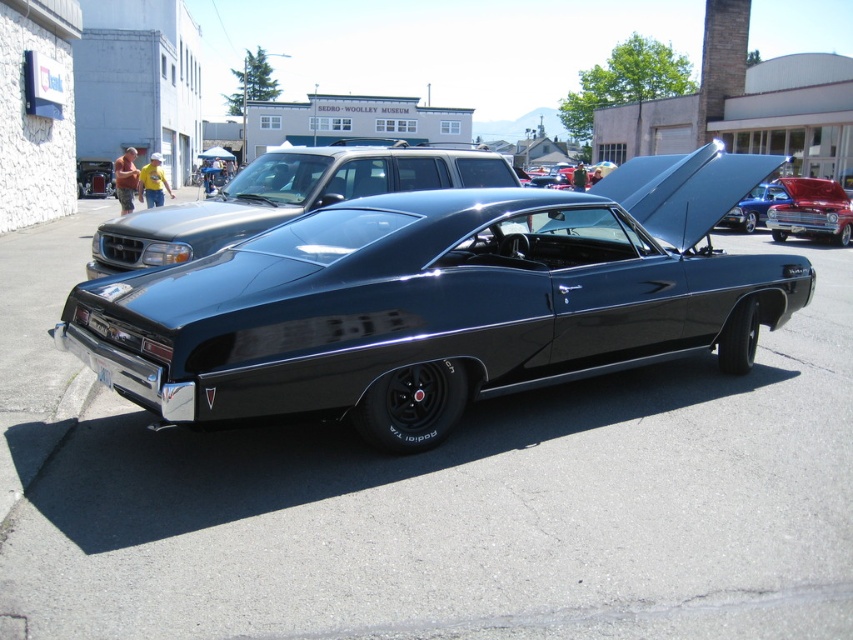
You are standing at the origin point of the coordinate system in the car show. The shiny black muscle car at center is located at point 0.470, 0.518. If you want to walk directly towards it, which direction should you move in relation to your current position?

Since the shiny black muscle car at center is located at coordinates [440,300], you should move northeast to reach it from the origin point.